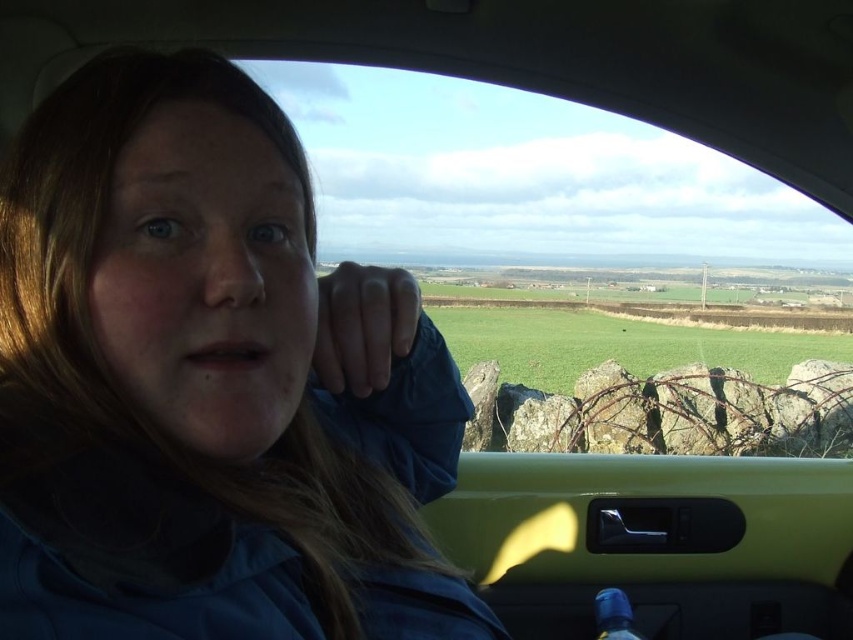
Question: Among these objects, which one is farthest from the camera?

Choices:
 (A) blue matte bottle at lower center
 (B) blue fabric at left

Answer: (A)

Question: Is blue fabric at left positioned before blue matte bottle at lower center?

Choices:
 (A) no
 (B) yes

Answer: (B)

Question: Which point is closer to the camera taking this photo?

Choices:
 (A) (614, 589)
 (B) (125, 368)

Answer: (B)

Question: Is blue fabric at left to the left of blue matte bottle at lower center from the viewer's perspective?

Choices:
 (A) yes
 (B) no

Answer: (A)

Question: Is blue fabric at left positioned in front of blue matte bottle at lower center?

Choices:
 (A) no
 (B) yes

Answer: (B)

Question: Which point is closer to the camera?

Choices:
 (A) blue fabric at left
 (B) blue matte bottle at lower center

Answer: (A)